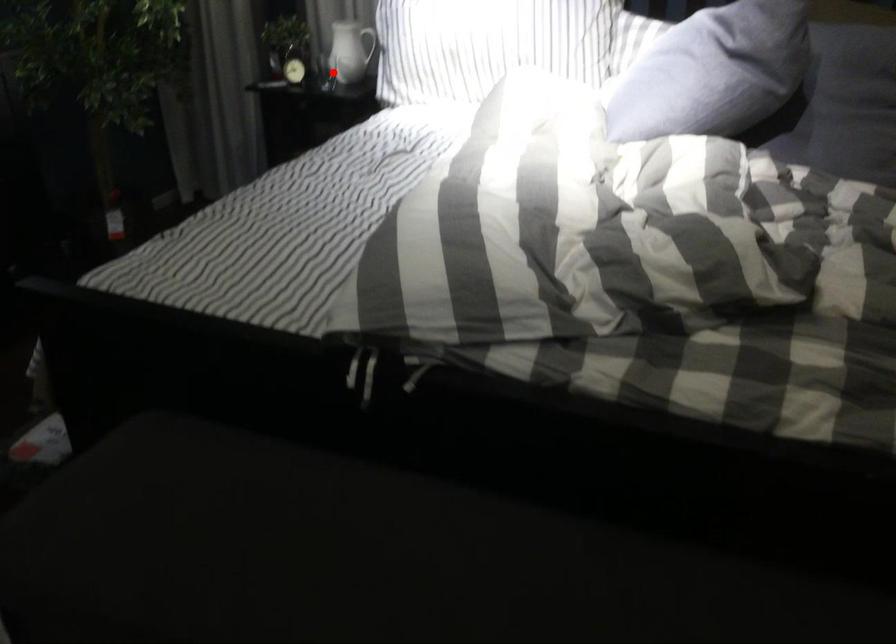
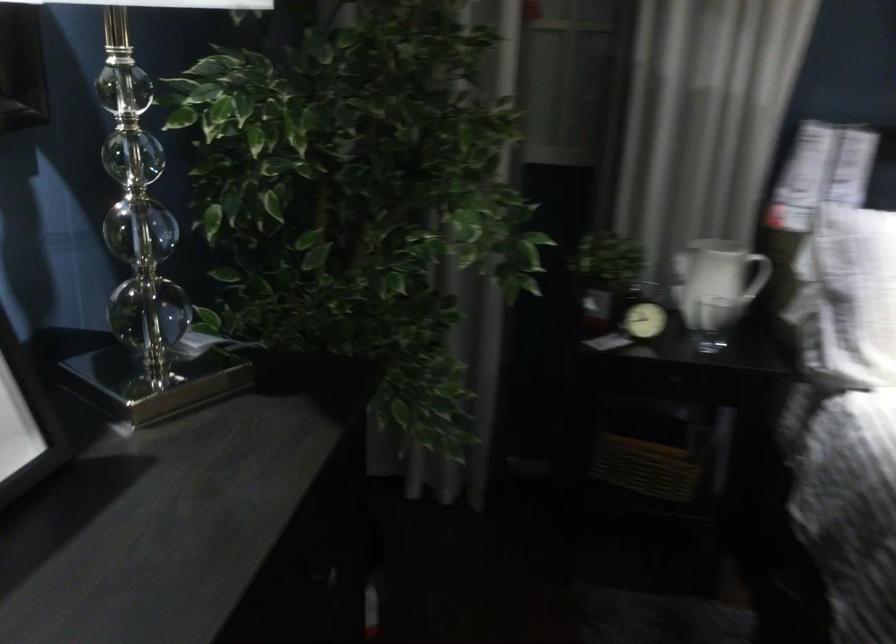
Question: A red point is marked in image1. In image2, is the corresponding 3D point closer to the camera or farther? Reply with the corresponding letter.

Choices:
 (A) The corresponding 3D point is closer.
 (B) The corresponding 3D point is farther.

Answer: (A)